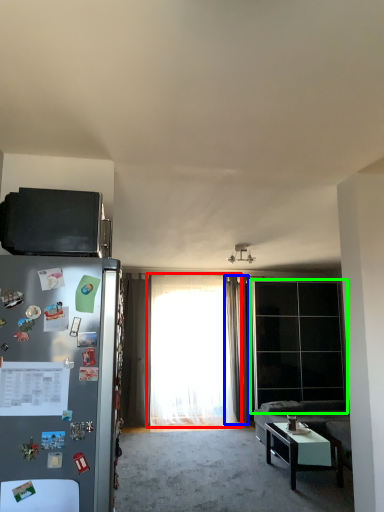
Question: Considering the real-world distances, which object is closest to curtain (highlighted by a red box)? curtain (highlighted by a blue box) or glass door (highlighted by a green box).

Choices:
 (A) curtain
 (B) glass door

Answer: (A)